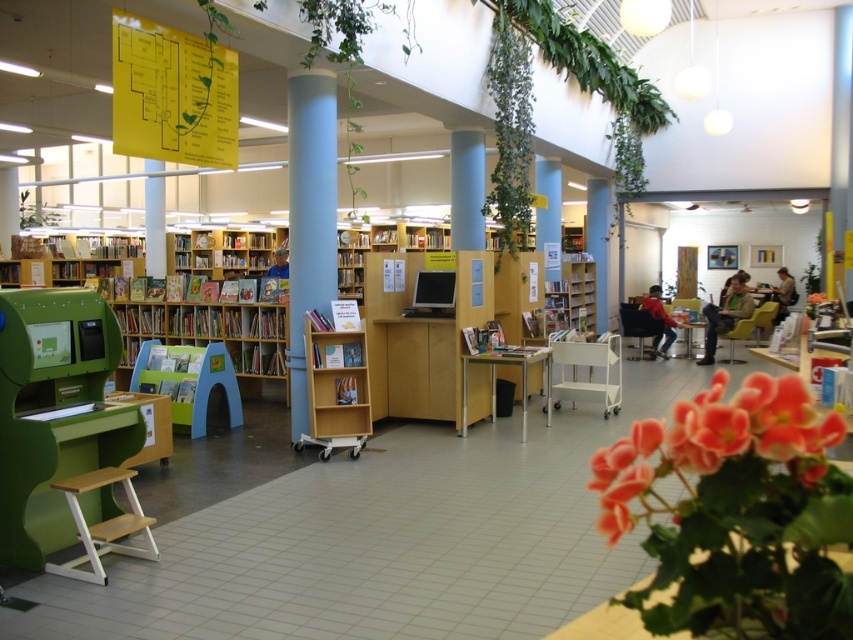
Is point (140, 109) less distant than point (596, 280)?

That is True.

Describe the element at coordinates (172, 93) in the screenshot. Image resolution: width=853 pixels, height=640 pixels. I see `yellow paper map at upper left` at that location.

Describe the element at coordinates (172, 93) in the screenshot. I see `yellow paper map at upper left` at that location.

Where is `yellow paper map at upper left`? yellow paper map at upper left is located at coordinates (172, 93).

Between light wood/bookshelf at center and white plastic cart at center, which one has less height?

Standing shorter between the two is white plastic cart at center.

Can you confirm if light wood/bookshelf at center is thinner than white plastic cart at center?

Yes, light wood/bookshelf at center is thinner than white plastic cart at center.

Find the location of a particular element. light wood/bookshelf at center is located at coordinates (335, 380).

Is white plastic cart at center bigger than hardcover book at center?

Yes, white plastic cart at center is bigger than hardcover book at center.

Can you confirm if white plastic cart at center is positioned to the left of hardcover book at center?

Incorrect, white plastic cart at center is not on the left side of hardcover book at center.

Locate an element on the screen. The width and height of the screenshot is (853, 640). white plastic cart at center is located at coordinates (587, 372).

Locate an element on the screen. white plastic cart at center is located at coordinates (587, 372).